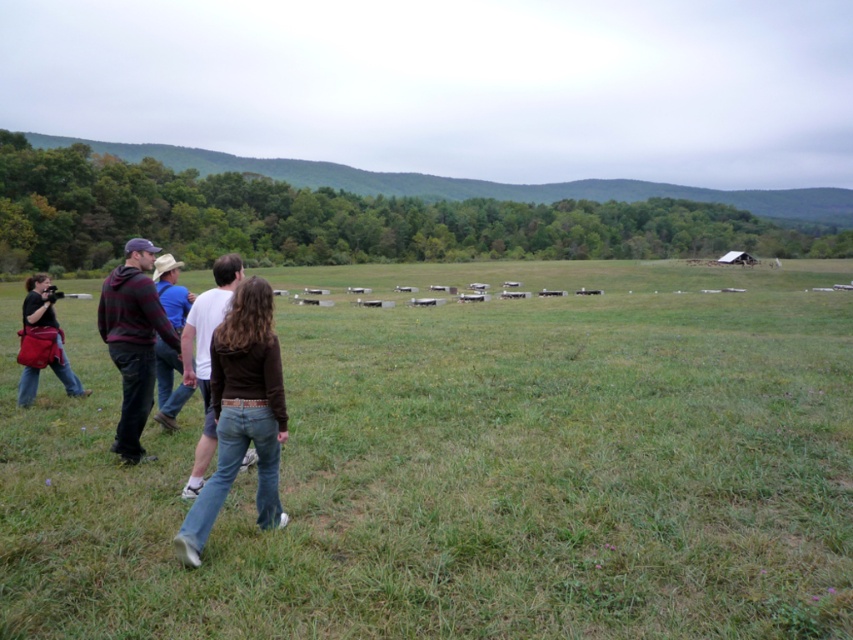
Does point (595, 458) come in front of point (86, 392)?

That is True.

The height and width of the screenshot is (640, 853). I want to click on green grass pasture at center, so click(468, 467).

Is denim jeans at center shorter than plaid wool sweater at left?

Yes, denim jeans at center is shorter than plaid wool sweater at left.

Can you confirm if denim jeans at center is taller than plaid wool sweater at left?

No, denim jeans at center is not taller than plaid wool sweater at left.

Measure the distance between point (x=225, y=451) and camera.

Point (x=225, y=451) is 4.20 meters from camera.

This screenshot has width=853, height=640. I want to click on denim jeans at center, so click(241, 413).

Does point (595, 508) lie behind point (148, 342)?

No, (595, 508) is closer to viewer.

Locate an element on the screen. green grass pasture at center is located at coordinates (468, 467).

I want to click on green grass pasture at center, so click(x=468, y=467).